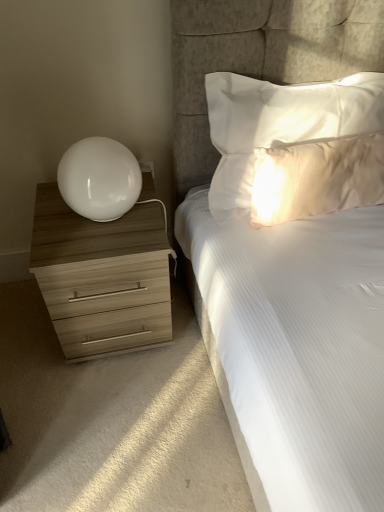
Where is `free space above wooden chest of drawers at left (from a real-world perspective)`? Image resolution: width=384 pixels, height=512 pixels. free space above wooden chest of drawers at left (from a real-world perspective) is located at coordinates (97, 228).